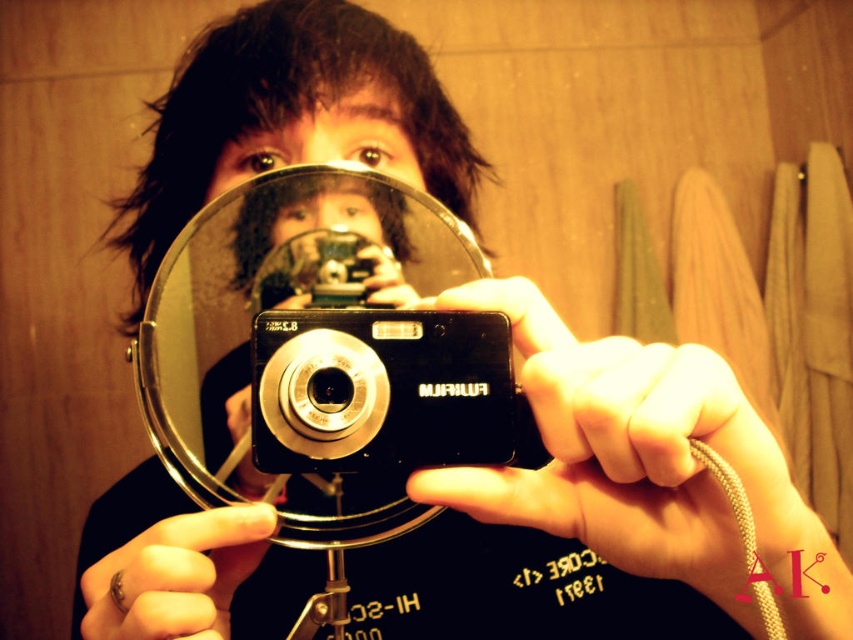
Does clear glass mirror at center appear on the right side of black plastic camera at center?

In fact, clear glass mirror at center is to the left of black plastic camera at center.

Which is in front, point (335, 509) or point (422, 388)?

Positioned in front is point (422, 388).

Find the location of `clear glass mirror at center`. clear glass mirror at center is located at coordinates (325, 348).

Where is `clear glass mirror at center`? This screenshot has width=853, height=640. clear glass mirror at center is located at coordinates (325, 348).